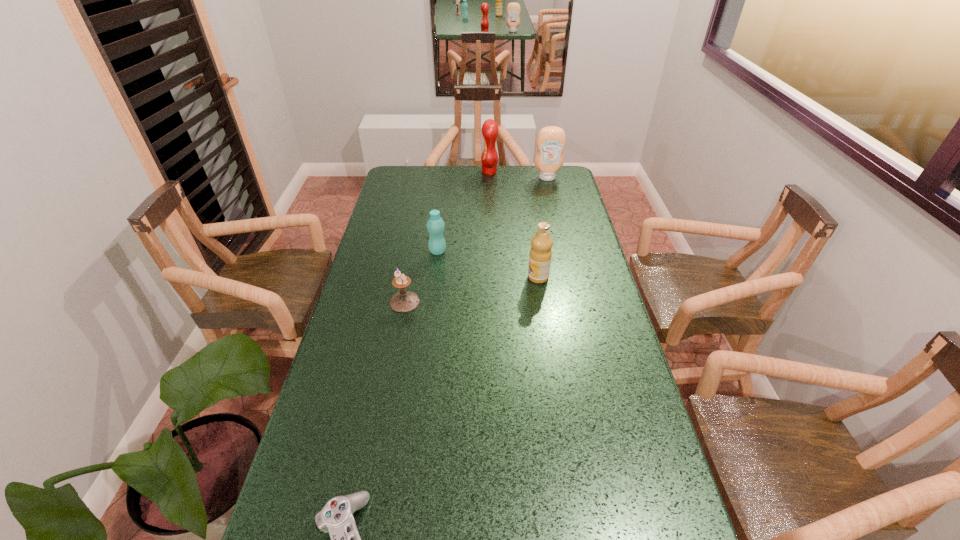
Locate an element on the screen. the left condiment is located at coordinates (489, 158).

Locate an element on the screen. This screenshot has width=960, height=540. the rightmost object is located at coordinates (551, 140).

Locate an element on the screen. the fifth object from left to right is located at coordinates (540, 255).

I want to click on olive oil, so click(540, 255).

Where is `the fourth nearest object`? This screenshot has height=540, width=960. the fourth nearest object is located at coordinates (435, 225).

You are a GUI agent. You are given a task and a screenshot of the screen. Output one action in this format:
    pyautogui.click(x=<x>, y=<y>)
    Task: Click on the candle holder
    Image resolution: width=960 pixels, height=540 pixels.
    Given the screenshot: What is the action you would take?
    pyautogui.click(x=404, y=301)

At what (x,y) coordinates should I click in order to perform the action: click on the second shortest object. Please return your answer as a coordinate pair (x, y). Looking at the image, I should click on click(x=404, y=301).

The image size is (960, 540). I want to click on free space located 0.270m on the label side of the third object from right to left, so (x=424, y=172).

Find the location of a particular element. Image resolution: width=960 pixels, height=540 pixels. vacant region located on the label side of the third object from right to left is located at coordinates click(440, 172).

This screenshot has width=960, height=540. What are the coordinates of `free spot located on the label side of the third object from right to left` in the screenshot? It's located at (406, 172).